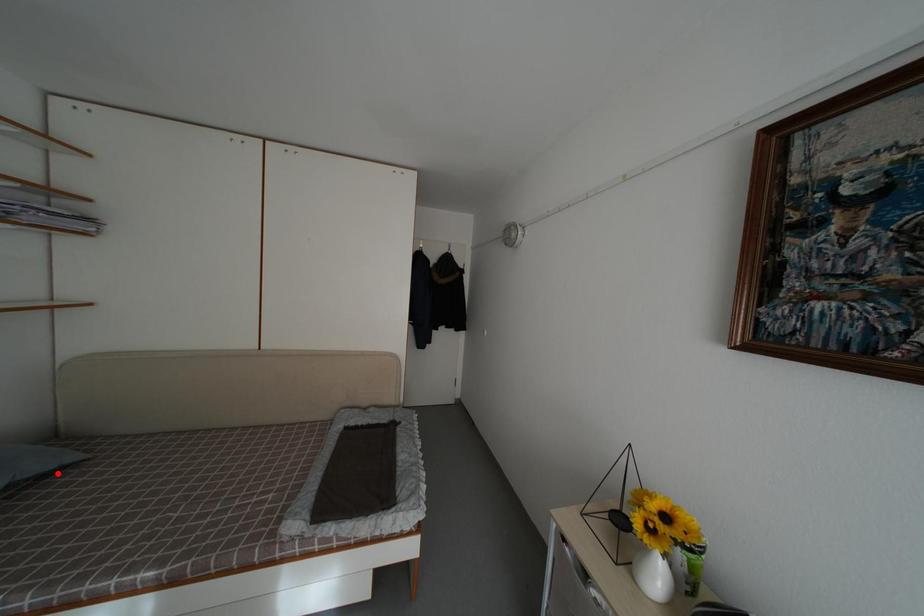
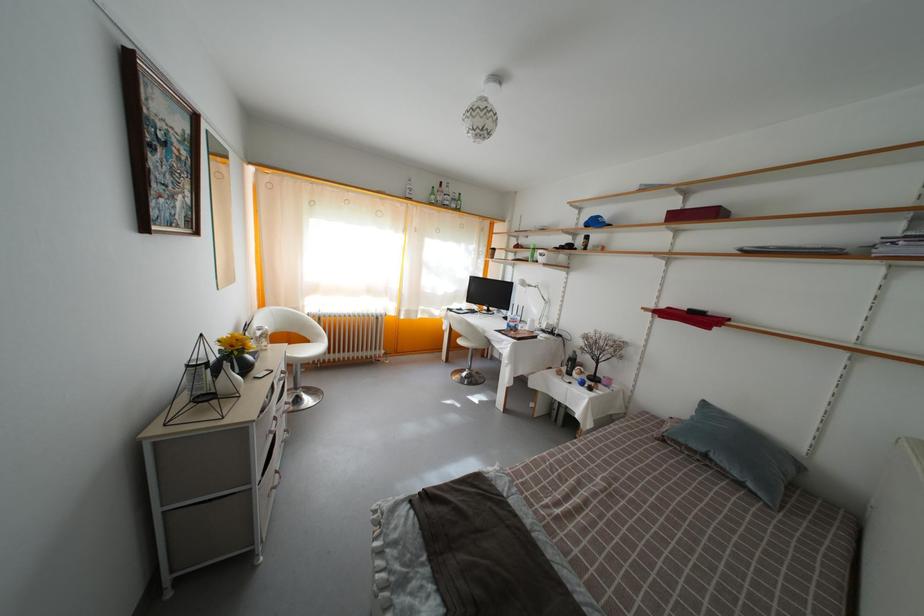
Locate, in the second image, the point that corresponds to the highlighted location in the first image.

(743, 482)